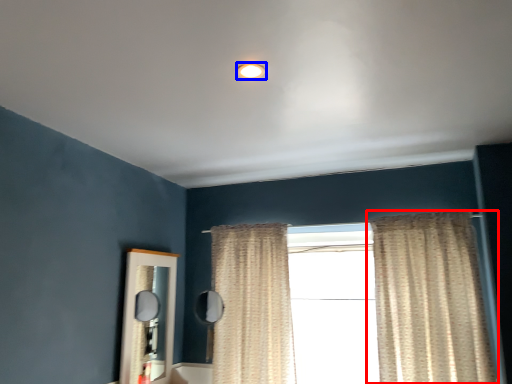
Question: Which point is closer to the camera, curtain (highlighted by a red box) or lighting (highlighted by a blue box)?

Choices:
 (A) curtain
 (B) lighting

Answer: (B)